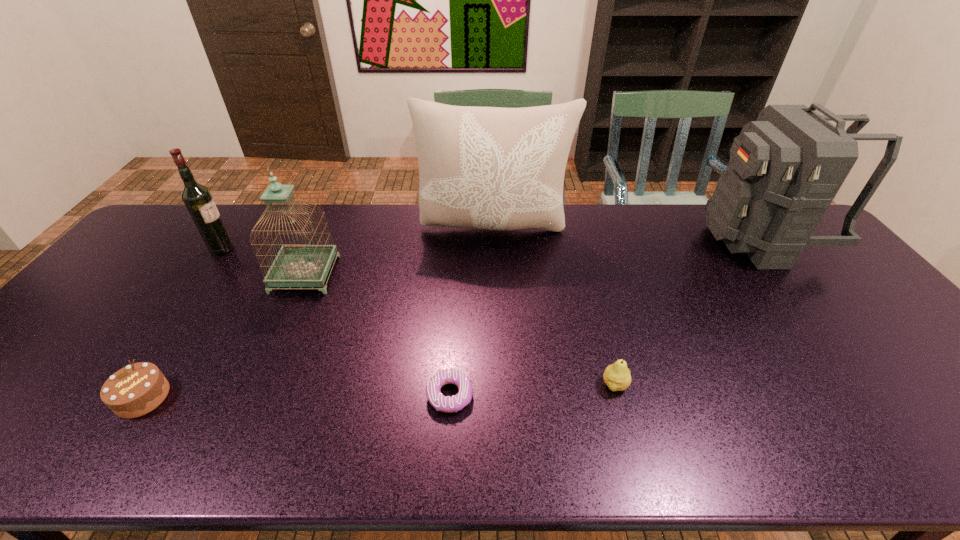
Locate an element on the screen. This screenshot has height=540, width=960. object located at the far right corner is located at coordinates (785, 169).

The height and width of the screenshot is (540, 960). Find the location of `free region at the far edge`. free region at the far edge is located at coordinates (567, 216).

Locate an element on the screen. vacant space at the near edge is located at coordinates pyautogui.click(x=423, y=429).

This screenshot has height=540, width=960. I want to click on free space at the left edge of the desktop, so click(x=38, y=393).

The image size is (960, 540). What are the coordinates of `blank space at the right edge of the desktop` in the screenshot? It's located at (892, 348).

This screenshot has width=960, height=540. I want to click on empty space between the shortest object and the chocolate cake, so click(x=297, y=396).

Image resolution: width=960 pixels, height=540 pixels. I want to click on free space between the sixth tallest object and the fifth object from right to left, so click(x=224, y=336).

The width and height of the screenshot is (960, 540). I want to click on free space between the doughnut and the wine bottle, so click(336, 322).

I want to click on free space between the birdcage and the pear, so click(x=460, y=329).

Image resolution: width=960 pixels, height=540 pixels. Find the location of `vacant region between the second shortest object and the birdcage`. vacant region between the second shortest object and the birdcage is located at coordinates (224, 336).